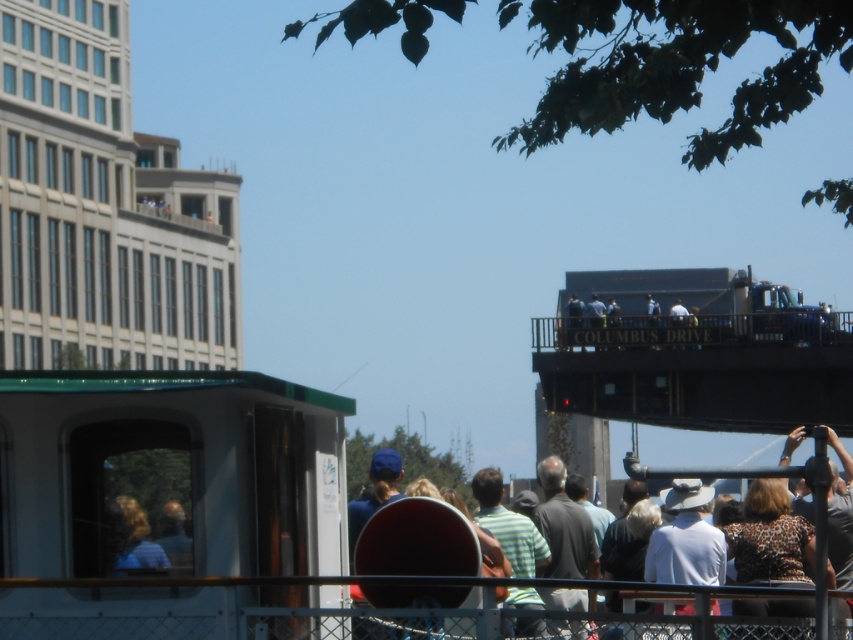
You are standing at the center of the scene and want to take a photo of both the brown leopard print shirt at lower right and the blonde hair at left in the same frame. Given that your camera has a maximum zoom of 10x, can you fit both subjects into the frame without moving closer?

The distance between the brown leopard print shirt at lower right and the blonde hair at left is 12.81 feet. Since the camera has a maximum zoom of 10x, it depends on the camera sensor size and lens focal length, but generally, a 10x zoom should allow capturing both subjects within the frame at this distance without needing to move closer.

You are an event planner organizing a photo shoot and need to position two models wearing the brown leopard print shirt at lower right and dark gray casual clothing at center. Based on the scene, which model should be placed closer to the camera to ensure both are visible in the frame?

The brown leopard print shirt at lower right should be placed closer to the camera because it occupies less space than the dark gray casual clothing at center, allowing both to fit within the frame.